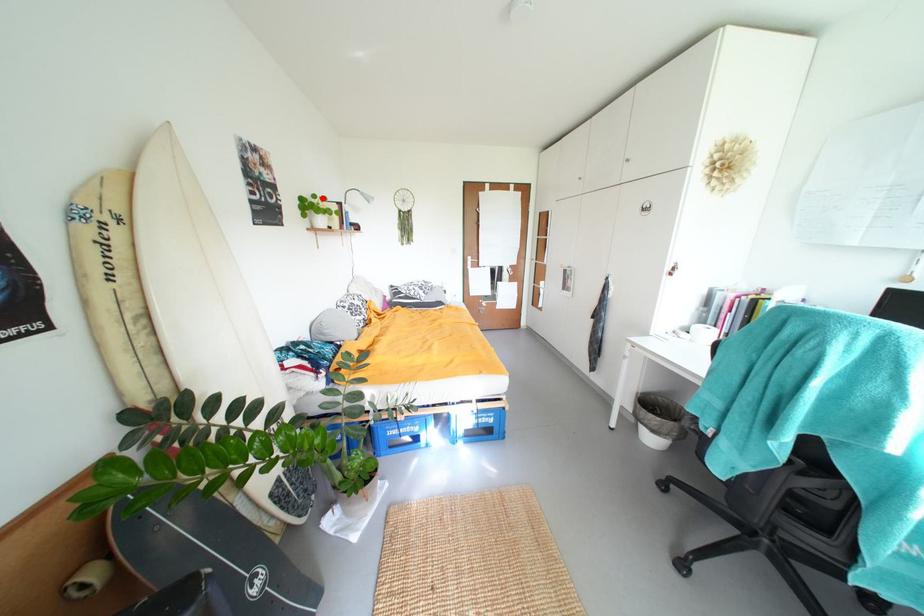
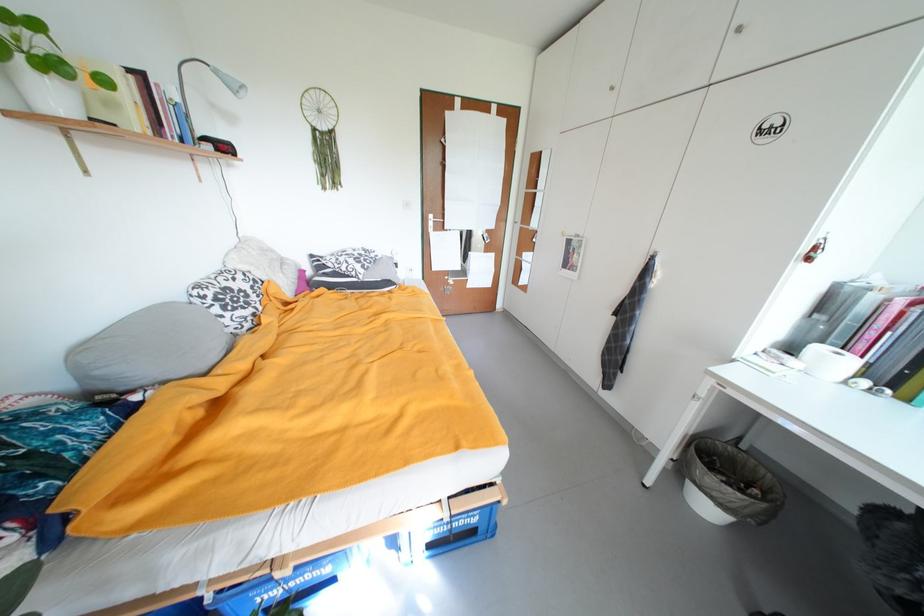
Question: I am providing you with two images of the same scene from different viewpoints. In image1, a red point is highlighted. Considering the same 3D point in image2, which of the following is correct?

Choices:
 (A) It is closer
 (B) It is farther

Answer: (B)